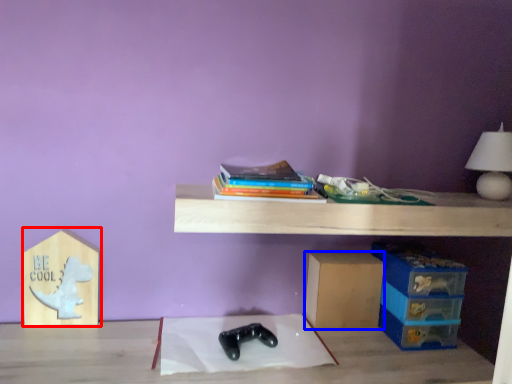
Question: Which object appears closest to the camera in this image, cardboard box (highlighted by a red box) or cardboard box (highlighted by a blue box)?

Choices:
 (A) cardboard box
 (B) cardboard box

Answer: (A)